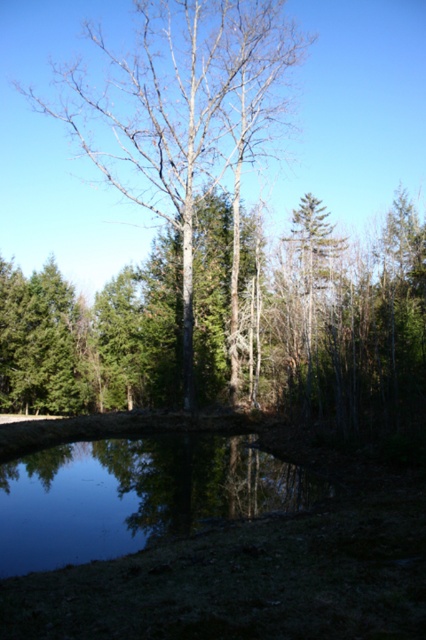
You are standing on the grassy bank of the pond and want to take a photo of the clear water at center. To include the bare wood tree at center in your shot, should you adjust your camera to the left or right?

To include the bare wood tree at center in your photo of the clear water at center, you should adjust your camera to the left because the bare wood tree at center is positioned on the left side of the clear water at center.

You are standing at the edge of the pond and want to walk from the grassy area to the clear water at center without stepping on the bare wood tree at center. Is this possible?

The bare wood tree at center might be wider than clear water at center, so there may not be enough space to walk around it without stepping on the tree. It is advisable to check the width before proceeding.